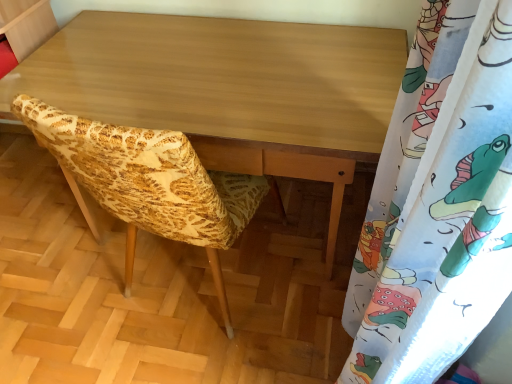
Question: From the image's perspective, is white fabric with colorful cartoon print at right below yellow fabric chair at center?

Choices:
 (A) yes
 (B) no

Answer: (A)

Question: Is white fabric with colorful cartoon print at right oriented towards yellow fabric chair at center?

Choices:
 (A) no
 (B) yes

Answer: (B)

Question: Is white fabric with colorful cartoon print at right in contact with yellow fabric chair at center?

Choices:
 (A) yes
 (B) no

Answer: (B)

Question: Does white fabric with colorful cartoon print at right have a greater height compared to yellow fabric chair at center?

Choices:
 (A) yes
 (B) no

Answer: (A)

Question: Would you say white fabric with colorful cartoon print at right contains yellow fabric chair at center?

Choices:
 (A) yes
 (B) no

Answer: (B)

Question: Is white fabric with colorful cartoon print at right completely or partially outside of yellow fabric chair at center?

Choices:
 (A) yes
 (B) no

Answer: (A)

Question: Considering the relative sizes of light brown wood desk at center and white fabric with colorful cartoon print at right in the image provided, is light brown wood desk at center bigger than white fabric with colorful cartoon print at right?

Choices:
 (A) yes
 (B) no

Answer: (A)

Question: Does light brown wood desk at center have a lesser width compared to white fabric with colorful cartoon print at right?

Choices:
 (A) no
 (B) yes

Answer: (A)

Question: Is light brown wood desk at center wider than white fabric with colorful cartoon print at right?

Choices:
 (A) no
 (B) yes

Answer: (B)

Question: Can you confirm if light brown wood desk at center is positioned to the left of white fabric with colorful cartoon print at right?

Choices:
 (A) no
 (B) yes

Answer: (B)

Question: Is light brown wood desk at center shorter than white fabric with colorful cartoon print at right?

Choices:
 (A) no
 (B) yes

Answer: (B)

Question: Is light brown wood desk at center facing away from white fabric with colorful cartoon print at right?

Choices:
 (A) yes
 (B) no

Answer: (B)

Question: Is yellow fabric chair at center at the back of light brown wood desk at center?

Choices:
 (A) no
 (B) yes

Answer: (A)